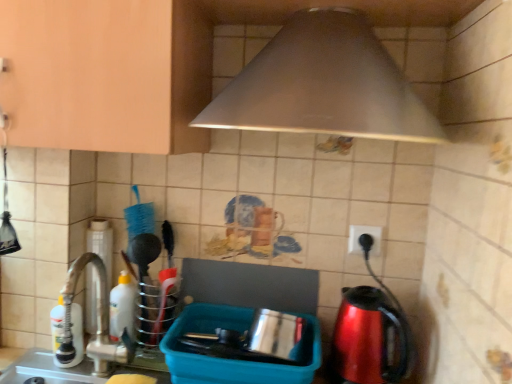
Question: Is white plastic bottle at left, the 1th bottle in the back-to-front sequence, oriented towards white glossy bottle at left, marked as the 1th bottle in a front-to-back arrangement?

Choices:
 (A) no
 (B) yes

Answer: (A)

Question: Would you consider white plastic bottle at left, the 2th bottle from the front, to be distant from white glossy bottle at left, which appears as the 2th bottle when viewed from the back?

Choices:
 (A) no
 (B) yes

Answer: (A)

Question: Is white plastic bottle at left, the 1th bottle in the back-to-front sequence, to the right of white glossy bottle at left, marked as the 1th bottle in a front-to-back arrangement, from the viewer's perspective?

Choices:
 (A) no
 (B) yes

Answer: (B)

Question: From the image's perspective, would you say white plastic bottle at left, the second bottle in the left-to-right sequence, is shown under white glossy bottle at left, marked as the 1th bottle in a front-to-back arrangement?

Choices:
 (A) yes
 (B) no

Answer: (B)

Question: Can you confirm if white plastic bottle at left, the 2th bottle from the front, is wider than white glossy bottle at left, placed as the 1th bottle when sorted from left to right?

Choices:
 (A) no
 (B) yes

Answer: (B)

Question: Based on their sizes in the image, would you say metallic stainless steel pot at center, the 1th appliance viewed from the right, is bigger or smaller than white plastic bottle at left, the 2th bottle from the front?

Choices:
 (A) big
 (B) small

Answer: (A)

Question: Would you say metallic stainless steel pot at center, positioned as the 2th appliance in left-to-right order, is to the left or to the right of white plastic bottle at left, the 2th bottle from the front, in the picture?

Choices:
 (A) right
 (B) left

Answer: (A)

Question: Considering the positions of metallic stainless steel pot at center, the 1th appliance viewed from the right, and white plastic bottle at left, the 2th bottle from the front, in the image, is metallic stainless steel pot at center, the 1th appliance viewed from the right, taller or shorter than white plastic bottle at left, the 2th bottle from the front,?

Choices:
 (A) tall
 (B) short

Answer: (B)

Question: Is point (310, 327) positioned closer to the camera than point (129, 279)?

Choices:
 (A) farther
 (B) closer

Answer: (B)

Question: In terms of height, does white plastic bottle at left, the second bottle in the left-to-right sequence, look taller or shorter compared to white plastic electric outlet at upper right?

Choices:
 (A) short
 (B) tall

Answer: (B)

Question: Considering their positions, is white plastic bottle at left, the 1th bottle in the back-to-front sequence, located in front of or behind white plastic electric outlet at upper right?

Choices:
 (A) behind
 (B) front

Answer: (B)

Question: From the image's perspective, is white plastic bottle at left, the 2th bottle from the front, located above or below white plastic electric outlet at upper right?

Choices:
 (A) above
 (B) below

Answer: (B)

Question: Is point (134, 304) closer or farther from the camera than point (348, 251)?

Choices:
 (A) farther
 (B) closer

Answer: (A)

Question: Is metallic stainless steel pot at center, the 1th appliance viewed from the right, to the left or to the right of brushed metal faucet at left, marked as the 1th appliance in a left-to-right arrangement, in the image?

Choices:
 (A) right
 (B) left

Answer: (A)

Question: From a real-world perspective, is metallic stainless steel pot at center, positioned as the 2th appliance in left-to-right order, above or below brushed metal faucet at left, marked as the 1th appliance in a left-to-right arrangement?

Choices:
 (A) above
 (B) below

Answer: (B)